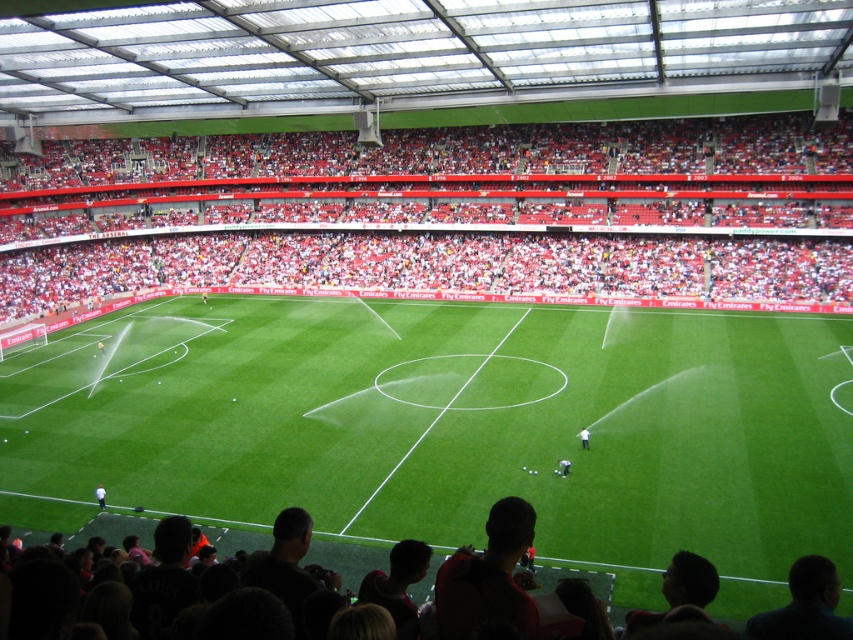
Does white fabric person at lower left have a greater width compared to white matte person at center?

Yes.

Who is more forward, (102, 504) or (585, 444)?

Point (102, 504)

Locate an element on the screen. This screenshot has width=853, height=640. white fabric person at lower left is located at coordinates (100, 496).

Is white fabric person at lower left above dark blue jersey at center?

No, white fabric person at lower left is not above dark blue jersey at center.

Who is more forward, (x=94, y=488) or (x=560, y=468)?

Positioned in front is point (x=94, y=488).

The image size is (853, 640). I want to click on white fabric person at lower left, so click(100, 496).

Does red plastic seats at upper center have a lesser width compared to dark blue jersey at center?

No, red plastic seats at upper center is not thinner than dark blue jersey at center.

Based on the photo, between red plastic seats at upper center and dark blue jersey at center, which one is positioned higher?

red plastic seats at upper center is above.

Between point (315, 241) and point (560, 468), which one is positioned behind?

Point (315, 241)

Find the location of a particular element. red plastic seats at upper center is located at coordinates (456, 216).